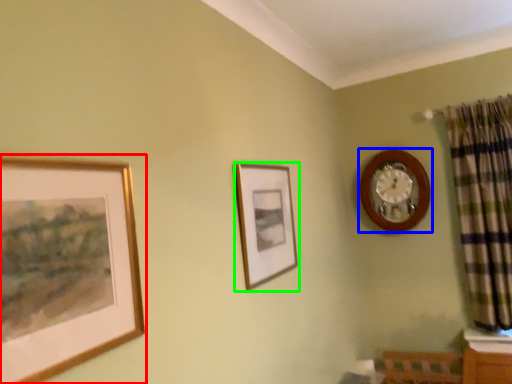
Question: Which is nearer to the picture frame (highlighted by a red box)? wall clock (highlighted by a blue box) or picture frame (highlighted by a green box).

Choices:
 (A) wall clock
 (B) picture frame

Answer: (B)